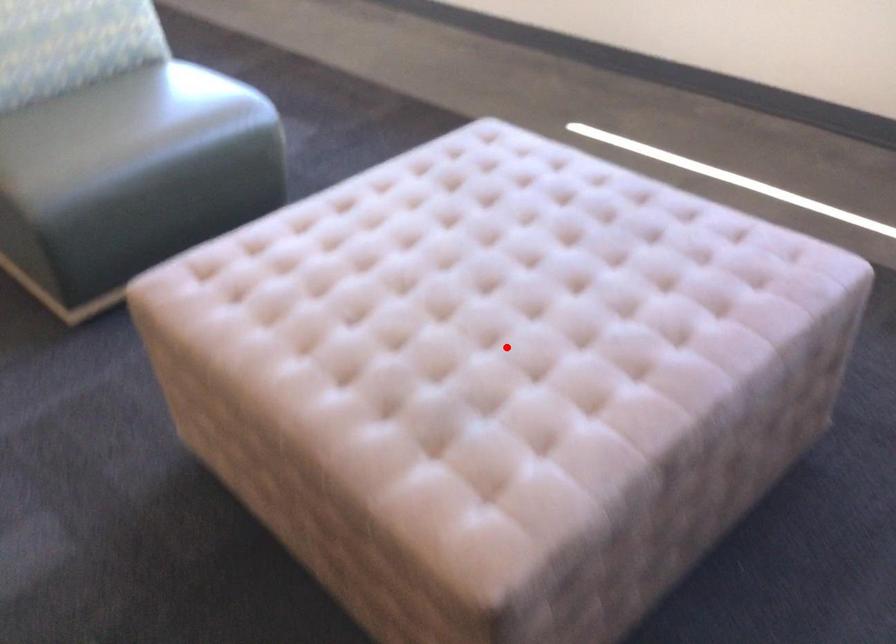
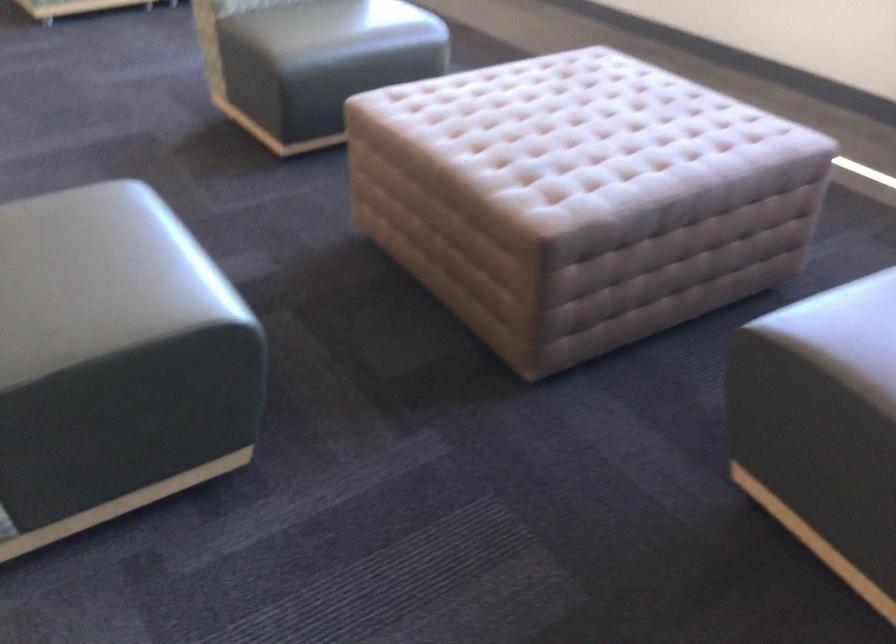
Find the pixel in the second image that matches the highlighted location in the first image.

(586, 147)